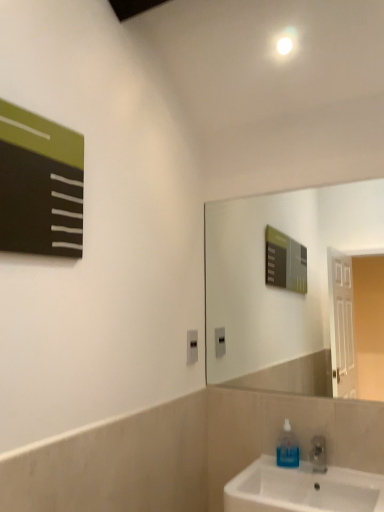
Question: Is white glossy sink at lower right far from transparent blue liquid at sink right?

Choices:
 (A) yes
 (B) no

Answer: (B)

Question: Considering the relative positions of white glossy sink at lower right and transparent blue liquid at sink right in the image provided, is white glossy sink at lower right to the left of transparent blue liquid at sink right from the viewer's perspective?

Choices:
 (A) no
 (B) yes

Answer: (A)

Question: Is white glossy sink at lower right bigger than transparent blue liquid at sink right?

Choices:
 (A) no
 (B) yes

Answer: (B)

Question: Considering the relative sizes of white glossy sink at lower right and transparent blue liquid at sink right in the image provided, is white glossy sink at lower right thinner than transparent blue liquid at sink right?

Choices:
 (A) yes
 (B) no

Answer: (B)

Question: Is white glossy sink at lower right looking in the opposite direction of transparent blue liquid at sink right?

Choices:
 (A) no
 (B) yes

Answer: (B)

Question: From their relative heights in the image, would you say matte black board at upper left is taller or shorter than black plastic outlet at center?

Choices:
 (A) tall
 (B) short

Answer: (A)

Question: In terms of width, does matte black board at upper left look wider or thinner when compared to black plastic outlet at center?

Choices:
 (A) wide
 (B) thin

Answer: (A)

Question: From the image's perspective, is matte black board at upper left positioned above or below black plastic outlet at center?

Choices:
 (A) above
 (B) below

Answer: (A)

Question: Is matte black board at upper left in front of or behind black plastic outlet at center in the image?

Choices:
 (A) behind
 (B) front

Answer: (B)

Question: From a real-world perspective, is black plastic outlet at center positioned above or below transparent blue liquid at sink right?

Choices:
 (A) above
 (B) below

Answer: (A)

Question: Is black plastic outlet at center to the left or to the right of transparent blue liquid at sink right in the image?

Choices:
 (A) left
 (B) right

Answer: (A)

Question: From the image's perspective, is black plastic outlet at center positioned above or below transparent blue liquid at sink right?

Choices:
 (A) above
 (B) below

Answer: (A)

Question: Is black plastic outlet at center spatially inside transparent blue liquid at sink right, or outside of it?

Choices:
 (A) outside
 (B) inside

Answer: (A)

Question: Is transparent blue liquid at sink right inside or outside of white glossy sink at lower right?

Choices:
 (A) inside
 (B) outside

Answer: (A)

Question: Is transparent blue liquid at sink right taller or shorter than white glossy sink at lower right?

Choices:
 (A) short
 (B) tall

Answer: (A)